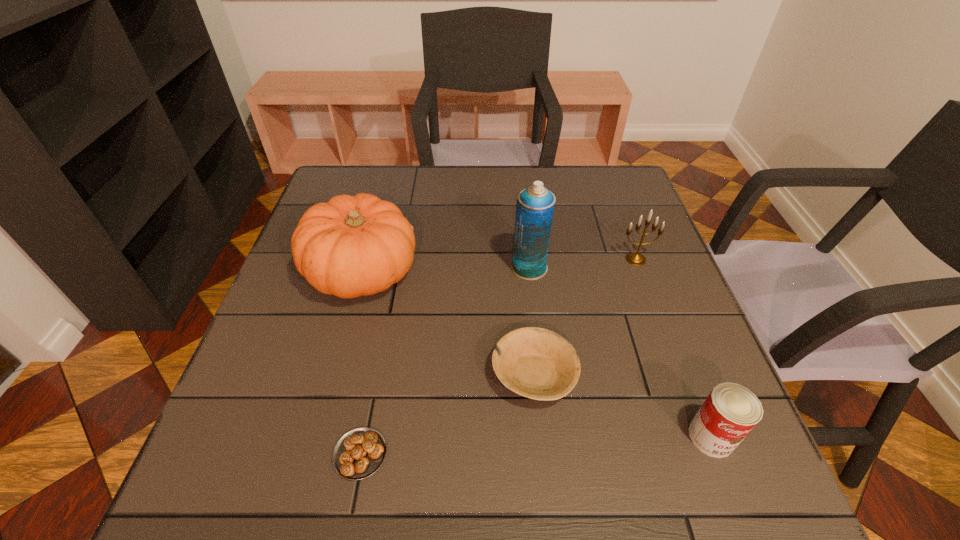
Identify the location of free space at the near edge of the desktop. The width and height of the screenshot is (960, 540). (628, 505).

Identify the location of vacant space at the left edge. (307, 282).

In the image, there is a desktop. Find the location of `vacant space at the right edge`. vacant space at the right edge is located at coordinates (662, 271).

I want to click on free space at the far right corner of the desktop, so pos(607,170).

Locate an element on the screen. The height and width of the screenshot is (540, 960). vacant point located between the tallest object and the shortest object is located at coordinates [x=444, y=361].

Locate an element on the screen. This screenshot has height=540, width=960. free space between the shortest object and the aerosol can is located at coordinates (444, 361).

Locate an element on the screen. vacant area that lies between the bowl and the fourth shortest object is located at coordinates (585, 317).

The image size is (960, 540). In order to click on empty space that is in between the fifth tallest object and the pumpkin in this screenshot , I will do `click(448, 323)`.

Where is `vacant space that is in between the third tallest object and the pumpkin`? vacant space that is in between the third tallest object and the pumpkin is located at coordinates (499, 266).

Locate an element on the screen. The width and height of the screenshot is (960, 540). empty space between the candelabrum and the third shortest object is located at coordinates (673, 348).